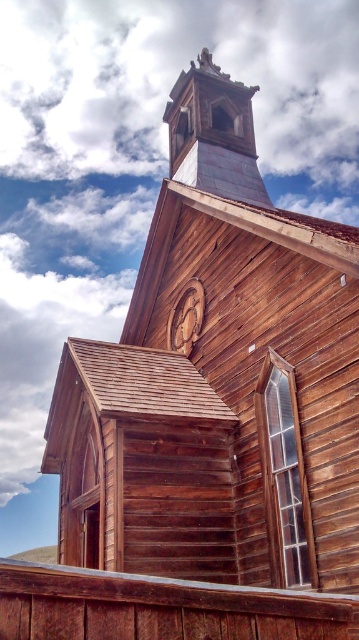
From the picture: You are standing in front of the wooden church and want to compare the wooden steeple at upper center and the wooden carving at center. Which one is bigger in size?

The wooden steeple at upper center is larger in size compared to the wooden carving at center.

You are standing in front of the wooden church and notice two wooden structures. One is the wooden steeple at upper center and the other is the wooden carving at center. Which of these is located higher up on the church?

The wooden steeple at upper center is positioned over the wooden carving at center, so it is located higher up on the church.